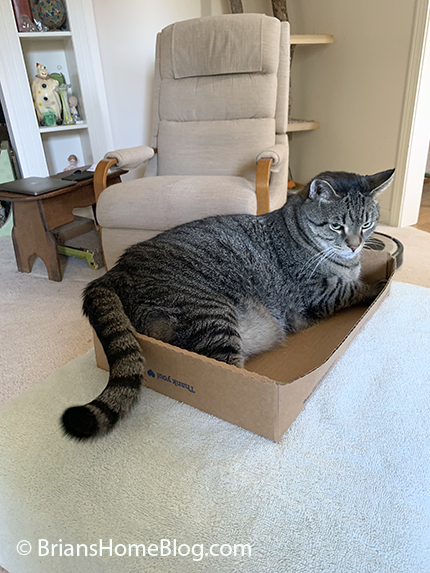
Identify the location of table. Image resolution: width=430 pixels, height=573 pixels. (45, 208).